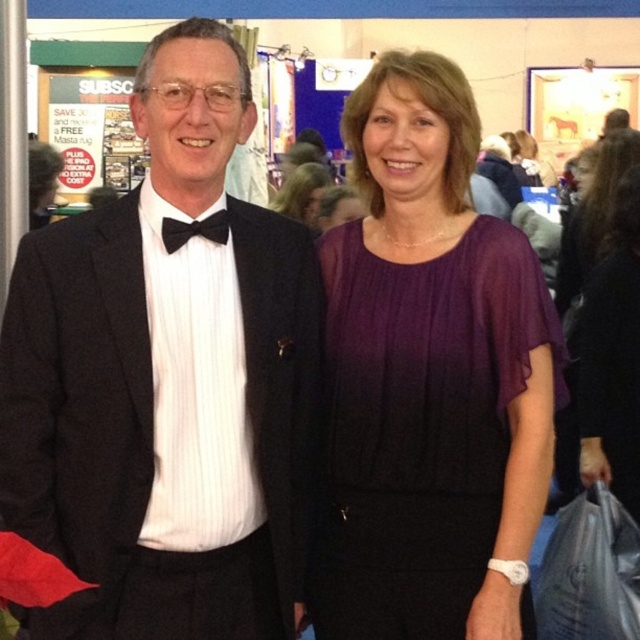
Question: Estimate the real-world distances between objects in this image. Which object is farther from the black satin suit at center?

Choices:
 (A) black satin bow tie at center
 (B) purple satin dress at center

Answer: (B)

Question: Which of the following is the closest to the observer?

Choices:
 (A) black satin suit at center
 (B) black satin bow tie at center

Answer: (A)

Question: From the image, what is the correct spatial relationship of black satin suit at center in relation to purple satin dress at center?

Choices:
 (A) left
 (B) right

Answer: (A)

Question: Considering the real-world distances, which object is closest to the black satin bow tie at center?

Choices:
 (A) purple satin dress at center
 (B) black satin suit at center

Answer: (B)

Question: Observing the image, what is the correct spatial positioning of purple satin dress at center in reference to black satin bow tie at center?

Choices:
 (A) below
 (B) above

Answer: (B)

Question: Can you confirm if black satin suit at center is positioned to the right of purple sheer dress at center?

Choices:
 (A) yes
 (B) no

Answer: (B)